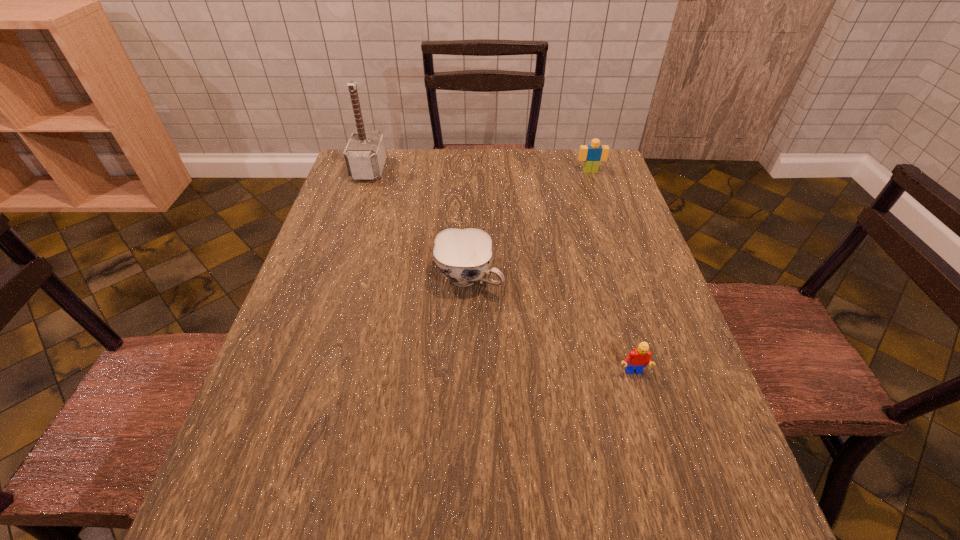
The height and width of the screenshot is (540, 960). Identify the location of unoccupied area between the farther Lego and the tallest object. (480, 171).

What are the coordinates of `free space between the farther Lego and the second object from left to right` in the screenshot? It's located at (529, 225).

Where is `vacant area between the farther Lego and the second nearest object`? The width and height of the screenshot is (960, 540). vacant area between the farther Lego and the second nearest object is located at coordinates coord(529,225).

Identify the location of free space that is in between the farther Lego and the leftmost object. Image resolution: width=960 pixels, height=540 pixels. (480, 171).

Image resolution: width=960 pixels, height=540 pixels. In order to click on free space that is in between the taller Lego and the nearer Lego in this screenshot , I will do `click(612, 272)`.

This screenshot has height=540, width=960. I want to click on free space between the taller Lego and the leftmost object, so click(x=480, y=171).

Where is `vacant point located between the tallest object and the chinaware`? This screenshot has height=540, width=960. vacant point located between the tallest object and the chinaware is located at coordinates (419, 224).

What are the coordinates of `object that is the closest to the second object from left to right` in the screenshot? It's located at (639, 358).

Locate an element on the screen. object that ranks as the third closest to the farther Lego is located at coordinates (639, 358).

The width and height of the screenshot is (960, 540). I want to click on free space that satisfies the following two spatial constraints: 1. on the back side of the second object from left to right; 2. for striking with the head of the leftmost object, so click(471, 170).